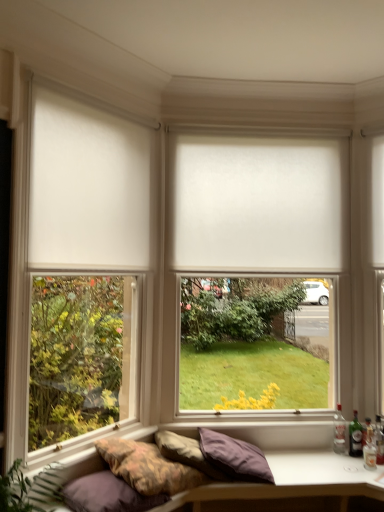
Locate an element on the screen. free space in front of green glass bottle at lower right, which appears as the 2th bottle when viewed from the left is located at coordinates (360, 464).